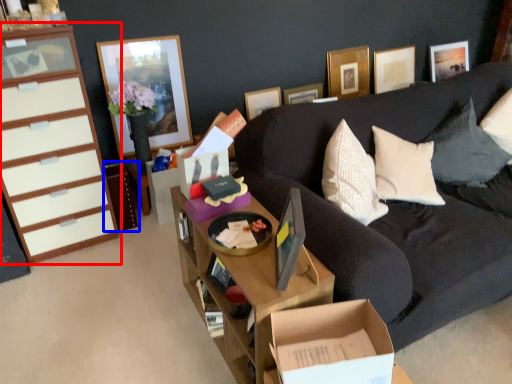
Question: Which of the following is the closest to the observer, cabinetry (highlighted by a red box) or cabinetry (highlighted by a blue box)?

Choices:
 (A) cabinetry
 (B) cabinetry

Answer: (A)